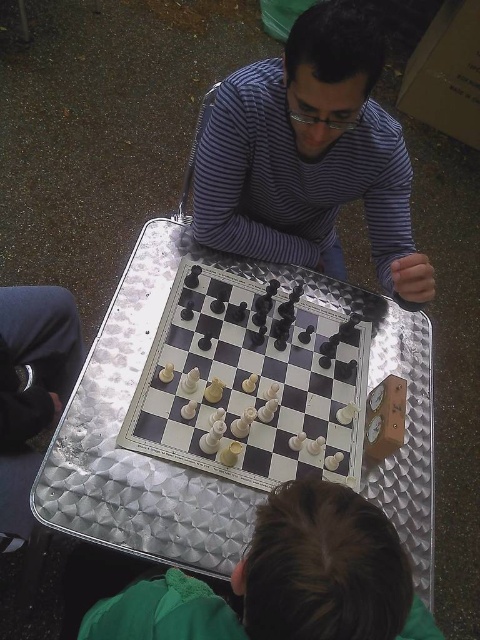
Question: Can you confirm if striped fabric shirt at upper center is positioned above white plastic chessboard at center?

Choices:
 (A) yes
 (B) no

Answer: (A)

Question: Considering the real-world distances, which object is closest to the metallic chessboard at center?

Choices:
 (A) striped fabric shirt at upper center
 (B) green fabric at lower center

Answer: (A)

Question: Does striped fabric shirt at upper center lie in front of green fabric at lower center?

Choices:
 (A) no
 (B) yes

Answer: (A)

Question: Which of the following is the closest to the observer?

Choices:
 (A) (308, 358)
 (B) (126, 486)

Answer: (B)

Question: Does metallic chessboard at center lie in front of green fabric at lower center?

Choices:
 (A) no
 (B) yes

Answer: (A)

Question: Which of the following is the closest to the observer?

Choices:
 (A) white plastic chessboard at center
 (B) green fabric at lower center

Answer: (B)